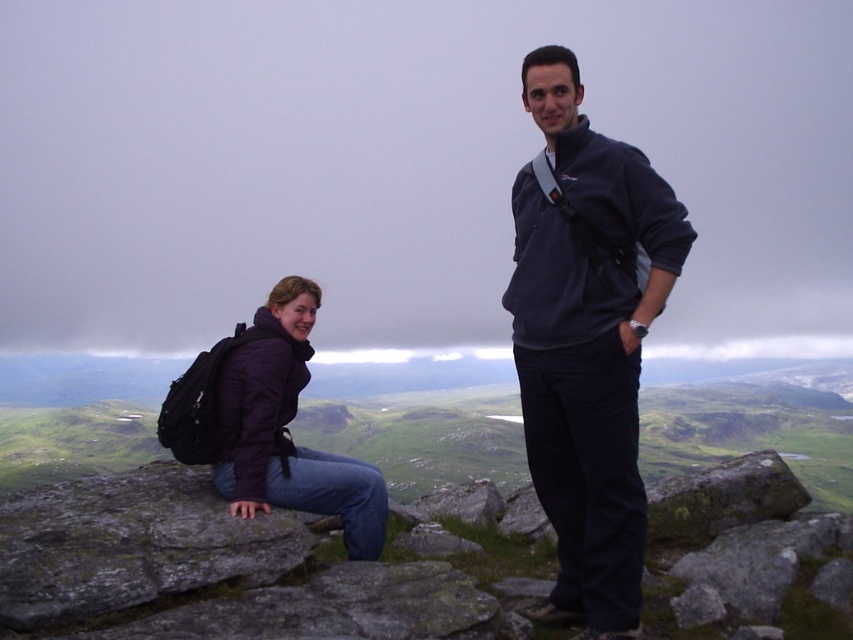
Question: Is navy fleece jacket at center positioned in front of matte purple jacket at left?

Choices:
 (A) no
 (B) yes

Answer: (B)

Question: Observing the image, what is the correct spatial positioning of navy fleece jacket at center in reference to matte purple jacket at left?

Choices:
 (A) right
 (B) left

Answer: (A)

Question: Which point is closer to the camera?

Choices:
 (A) (569, 420)
 (B) (624, 346)

Answer: (B)

Question: Which point appears farthest from the camera in this image?

Choices:
 (A) (575, 547)
 (B) (595, 225)

Answer: (B)

Question: Among these points, which one is farthest from the camera?

Choices:
 (A) (645, 276)
 (B) (553, 516)
 (C) (247, 381)

Answer: (C)

Question: Observing the image, what is the correct spatial positioning of navy fleece jacket at center in reference to matte purple jacket at left?

Choices:
 (A) above
 (B) below

Answer: (B)